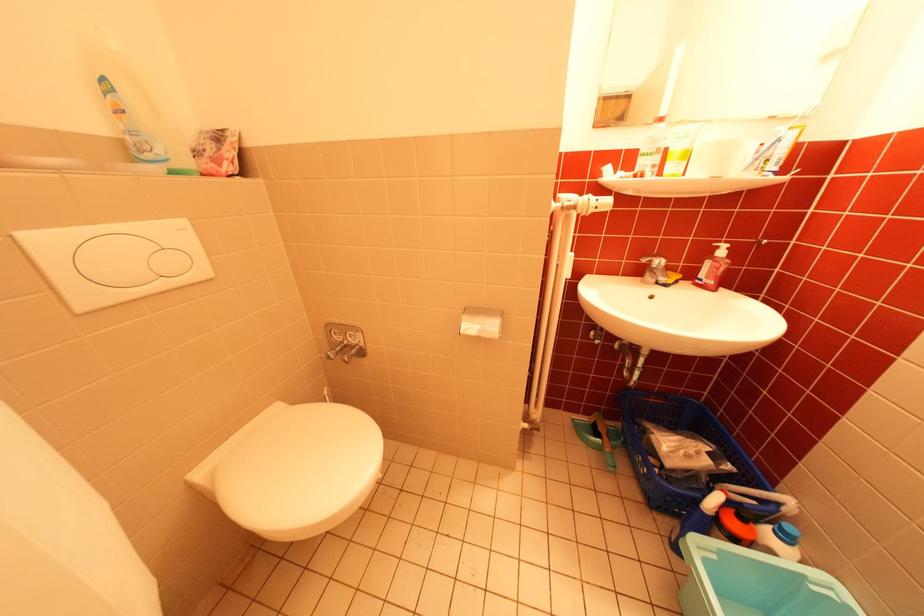
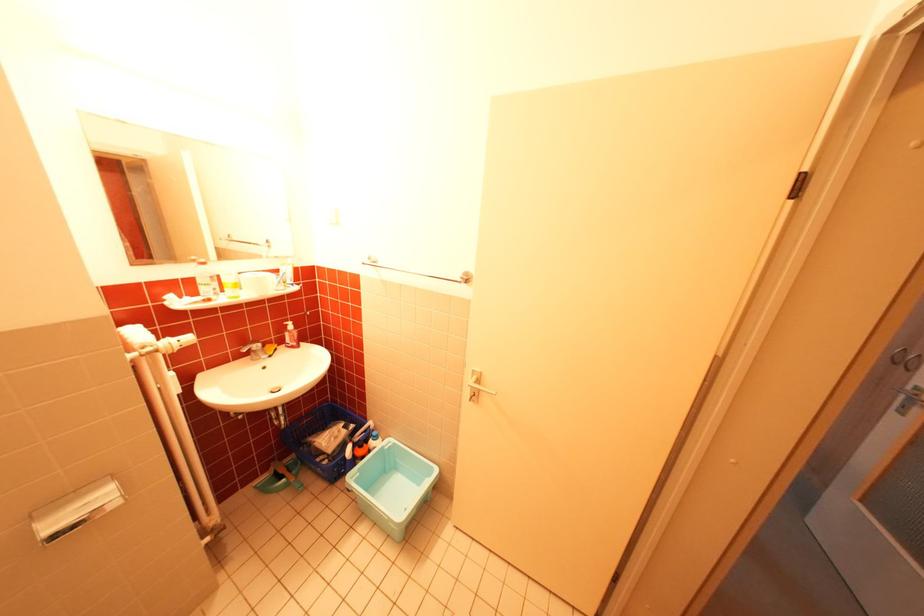
In the second image, find the point that corresponds to pixel 714 270 in the first image.

(298, 339)